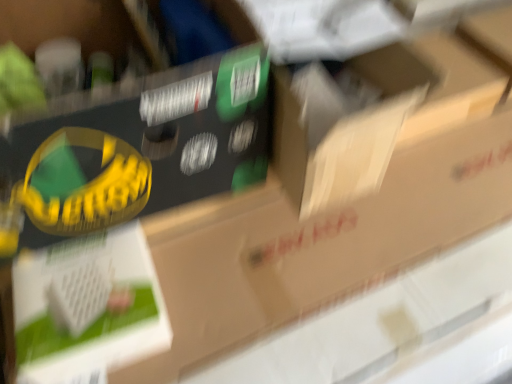
Question: From a real-world perspective, is cardboard box at center positioned above or below cardboard box at center?

Choices:
 (A) below
 (B) above

Answer: (B)

Question: Is cardboard box at center spatially inside cardboard box at center, or outside of it?

Choices:
 (A) inside
 (B) outside

Answer: (B)

Question: From the image's perspective, relative to cardboard box at center, is cardboard box at center above or below?

Choices:
 (A) below
 (B) above

Answer: (A)

Question: From a real-world perspective, is cardboard box at center physically located above or below cardboard box at center?

Choices:
 (A) above
 (B) below

Answer: (B)

Question: Considering their positions, is cardboard box at center located in front of or behind cardboard box at center?

Choices:
 (A) front
 (B) behind

Answer: (A)

Question: From the image's perspective, is cardboard box at center located above or below cardboard box at center?

Choices:
 (A) above
 (B) below

Answer: (A)

Question: Is point (80, 226) positioned closer to the camera than point (325, 102)?

Choices:
 (A) closer
 (B) farther

Answer: (A)